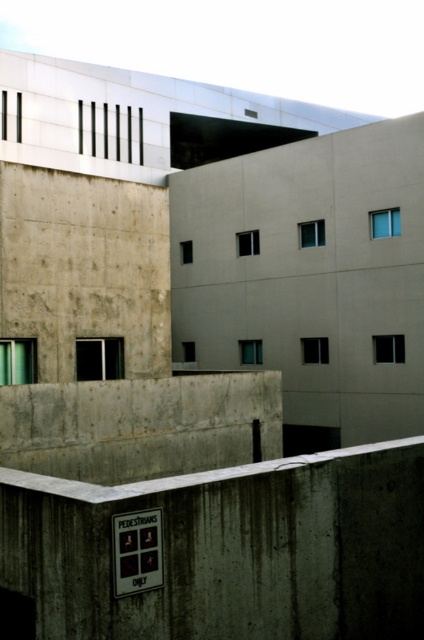
You are a delivery robot with a height of 1.5 meters. You need to navigate through the area between the gray concrete wall at lower center and the concrete ledge at lower center. Can you pass through this space without any issues?

The distance between the gray concrete wall at lower center and the concrete ledge at lower center is 2.11 meters. Since the robot is 1.5 meters tall, it can pass through the space as the height is sufficient.

You are standing in front of the modern architectural structure and want to place a small potted plant on the closest surface. Which surface should you choose between the gray concrete wall at lower center and the concrete ledge at lower center?

The gray concrete wall at lower center is closer to the viewer than the concrete ledge at lower center, so you should place the potted plant on the gray concrete wall at lower center.

You are standing at the entrance of the modern architectural structure. You want to reach a specific point marked at coordinates point (198, 522). Given that your current position is 15 feet away from the building, can you estimate whether you need to move forward or backward to reach this point?

The distance of point (198, 522) from camera is 10.50 feet. Since you are currently 15 feet away from the building, you need to move forward by 4.5 feet to reach the point.